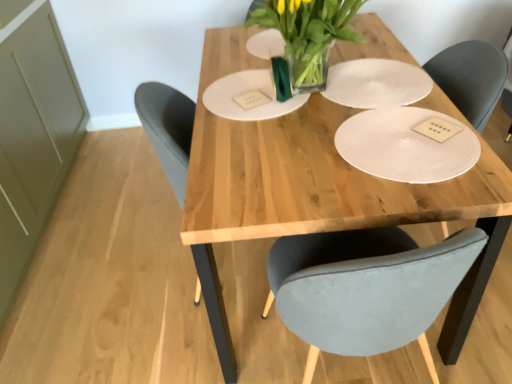
What do you see at coordinates (247, 91) in the screenshot? This screenshot has height=384, width=512. I see `white matte paper plate at center, which appears as the 2th paper plate when viewed from the right` at bounding box center [247, 91].

The image size is (512, 384). What do you see at coordinates (407, 144) in the screenshot? I see `white textured plate at center` at bounding box center [407, 144].

Find the location of a particular element. This screenshot has height=384, width=512. translucent glass vase at center is located at coordinates (308, 34).

Is white textured paper plate at center, placed as the second paper plate when sorted from left to right, thinner than white matte paper plate at center, which appears as the 2th paper plate when viewed from the right?

Yes, white textured paper plate at center, placed as the second paper plate when sorted from left to right, is thinner than white matte paper plate at center, which appears as the 2th paper plate when viewed from the right.

Is white textured paper plate at center, the first paper plate in the right-to-left sequence, behind white matte paper plate at center, which is counted as the 1th paper plate, starting from the left?

No, the depth of white textured paper plate at center, the first paper plate in the right-to-left sequence, is less than that of white matte paper plate at center, which is counted as the 1th paper plate, starting from the left.

From a real-world perspective, which is physically above, white textured paper plate at center, the first paper plate in the right-to-left sequence, or white matte paper plate at center, which is counted as the 1th paper plate, starting from the left?

In real-world perspective, white matte paper plate at center, which is counted as the 1th paper plate, starting from the left, is above.

Is white textured paper plate at center, the first paper plate in the right-to-left sequence, inside the boundaries of white matte paper plate at center, which appears as the 2th paper plate when viewed from the right, or outside?

The correct answer is: outside.

In the scene shown: Is white textured paper plate at center, placed as the second paper plate when sorted from left to right, taller than translucent glass vase at center?

In fact, white textured paper plate at center, placed as the second paper plate when sorted from left to right, may be shorter than translucent glass vase at center.

Considering the relative positions of white textured paper plate at center, placed as the second paper plate when sorted from left to right, and translucent glass vase at center in the image provided, is white textured paper plate at center, placed as the second paper plate when sorted from left to right, behind translucent glass vase at center?

Yes, it is.

From the picture: Is white textured paper plate at center, placed as the second paper plate when sorted from left to right, not within translucent glass vase at center?

Yes, white textured paper plate at center, placed as the second paper plate when sorted from left to right, is outside of translucent glass vase at center.

From the picture: Is translucent glass vase at center at the back of white matte paper plate at center, which appears as the 2th paper plate when viewed from the right?

No, white matte paper plate at center, which appears as the 2th paper plate when viewed from the right, is not facing the opposite direction of translucent glass vase at center.

Which point is more distant from viewer, (221, 84) or (317, 28)?

The point (221, 84) is farther.

Considering the positions of objects white matte paper plate at center, which appears as the 2th paper plate when viewed from the right, and translucent glass vase at center in the image provided, who is more to the right, white matte paper plate at center, which appears as the 2th paper plate when viewed from the right, or translucent glass vase at center?

translucent glass vase at center.

Is point (252, 17) closer or farther from the camera than point (377, 102)?

Point (252, 17) is positioned farther from the camera compared to point (377, 102).

Find the location of `the 2nd paper plate directly beneath the translucent glass vase at center (from a real-world perspective)`. the 2nd paper plate directly beneath the translucent glass vase at center (from a real-world perspective) is located at coordinates (376, 83).

Between translucent glass vase at center and white textured paper plate at center, the first paper plate in the right-to-left sequence, which one appears on the left side from the viewer's perspective?

translucent glass vase at center is more to the left.

Consider the image. In terms of height, does translucent glass vase at center look taller or shorter compared to white textured plate at center?

translucent glass vase at center is taller than white textured plate at center.

Is translucent glass vase at center bigger than white textured plate at center?

Correct, translucent glass vase at center is larger in size than white textured plate at center.

Between translucent glass vase at center and white textured plate at center, which one appears on the right side from the viewer's perspective?

white textured plate at center is more to the right.

From a real-world perspective, is translucent glass vase at center below white textured plate at center?

No.

Is white matte paper plate at center, which appears as the 2th paper plate when viewed from the right, at the right side of white textured paper plate at center, the first paper plate in the right-to-left sequence?

No, white matte paper plate at center, which appears as the 2th paper plate when viewed from the right, is not to the right of white textured paper plate at center, the first paper plate in the right-to-left sequence.

Which of these two, white matte paper plate at center, which is counted as the 1th paper plate, starting from the left, or white textured paper plate at center, the first paper plate in the right-to-left sequence, is smaller?

white textured paper plate at center, the first paper plate in the right-to-left sequence.

In terms of width, does white matte paper plate at center, which appears as the 2th paper plate when viewed from the right, look wider or thinner when compared to white textured paper plate at center, the first paper plate in the right-to-left sequence?

Considering their sizes, white matte paper plate at center, which appears as the 2th paper plate when viewed from the right, looks broader than white textured paper plate at center, the first paper plate in the right-to-left sequence.

Between white matte paper plate at center, which is counted as the 1th paper plate, starting from the left, and white textured paper plate at center, the first paper plate in the right-to-left sequence, which one has more height?

white matte paper plate at center, which is counted as the 1th paper plate, starting from the left, is taller.

Looking at this image, which object is wider, white textured plate at center or natural wood table at center?

Wider between the two is natural wood table at center.

Is white textured plate at center not within natural wood table at center?

No, white textured plate at center is inside natural wood table at center's boundary.

Does white textured plate at center have a lesser height compared to natural wood table at center?

Yes.

Considering the positions of objects white textured plate at center and natural wood table at center in the image provided, who is behind, white textured plate at center or natural wood table at center?

white textured plate at center is more distant.

What are the coordinates of `paper plate on the right of white matte paper plate at center, which appears as the 2th paper plate when viewed from the right` in the screenshot? It's located at coord(376,83).

Identify the location of floral arrangement in front of the white textured paper plate at center, placed as the second paper plate when sorted from left to right. The image size is (512, 384). (308, 34).

Looking at the image, which one is located further to natural wood table at center, white matte paper plate at center, which is counted as the 1th paper plate, starting from the left, or white textured paper plate at center, placed as the second paper plate when sorted from left to right?

white textured paper plate at center, placed as the second paper plate when sorted from left to right, lies further to natural wood table at center than the other object.

Based on their spatial positions, is white textured paper plate at center, the first paper plate in the right-to-left sequence, or white matte paper plate at center, which appears as the 2th paper plate when viewed from the right, further from natural wood table at center?

white textured paper plate at center, the first paper plate in the right-to-left sequence, lies further to natural wood table at center than the other object.

Based on their spatial positions, is natural wood table at center or white matte paper plate at center, which appears as the 2th paper plate when viewed from the right, further from white textured paper plate at center, placed as the second paper plate when sorted from left to right?

The object further to white textured paper plate at center, placed as the second paper plate when sorted from left to right, is natural wood table at center.

From the image, which object appears to be nearer to white textured paper plate at center, the first paper plate in the right-to-left sequence, natural wood table at center or translucent glass vase at center?

translucent glass vase at center.

From the image, which object appears to be farther from translucent glass vase at center, white textured plate at center or natural wood table at center?

white textured plate at center is positioned further to the anchor translucent glass vase at center.

From the picture: Which object lies nearer to the anchor point translucent glass vase at center, white matte paper plate at center, which is counted as the 1th paper plate, starting from the left, or white textured paper plate at center, placed as the second paper plate when sorted from left to right?

white textured paper plate at center, placed as the second paper plate when sorted from left to right, is closer to translucent glass vase at center.

From the image, which object appears to be nearer to natural wood table at center, white textured plate at center or white textured paper plate at center, placed as the second paper plate when sorted from left to right?

white textured plate at center lies closer to natural wood table at center than the other object.

Estimate the real-world distances between objects in this image. Which object is further from white textured paper plate at center, placed as the second paper plate when sorted from left to right, natural wood table at center or white textured plate at center?

natural wood table at center lies further to white textured paper plate at center, placed as the second paper plate when sorted from left to right, than the other object.

This screenshot has width=512, height=384. Identify the location of plate between natural wood table at center and white textured paper plate at center, the first paper plate in the right-to-left sequence, in the front-back direction. (407, 144).

Image resolution: width=512 pixels, height=384 pixels. I want to click on paper plate positioned between natural wood table at center and white matte paper plate at center, which appears as the 2th paper plate when viewed from the right, from near to far, so click(376, 83).

The image size is (512, 384). In order to click on floral arrangement between white matte paper plate at center, which is counted as the 1th paper plate, starting from the left, and white textured paper plate at center, placed as the second paper plate when sorted from left to right, from left to right in this screenshot , I will do `click(308, 34)`.

Locate an element on the screen. The image size is (512, 384). paper plate between white matte paper plate at center, which appears as the 2th paper plate when viewed from the right, and white textured plate at center, in the horizontal direction is located at coordinates (376, 83).